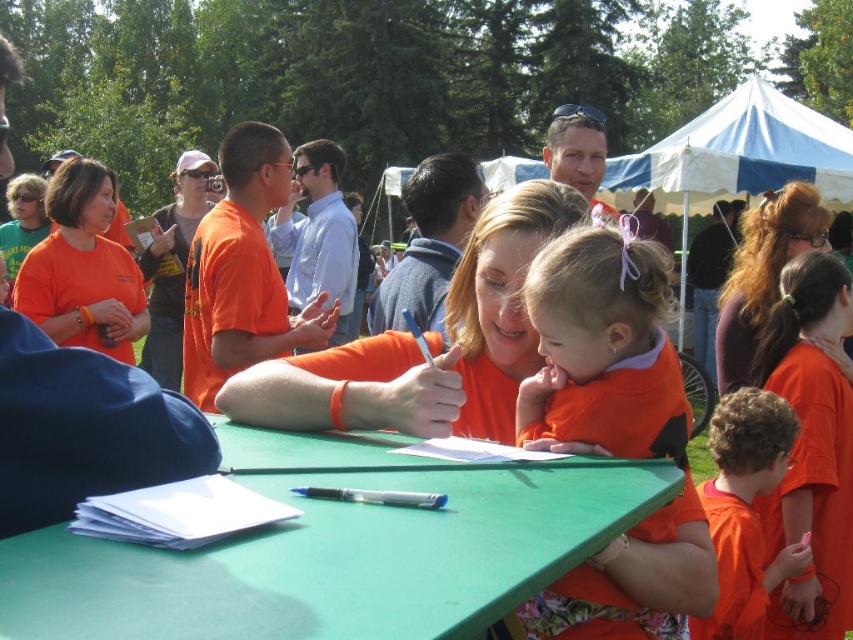
Who is positioned more to the left, green plastic table at center or orange matte shirt at lower right?

green plastic table at center

Which is more to the right, green plastic table at center or orange matte shirt at lower right?

From the viewer's perspective, orange matte shirt at lower right appears more on the right side.

Who is more distant from viewer, (146,582) or (741,582)?

The point (741,582) is more distant.

The image size is (853, 640). I want to click on green plastic table at center, so [x=337, y=548].

Is point (590, 307) more distant than point (697, 490)?

No, it is not.

The image size is (853, 640). In order to click on orange soft fabric baby at center in this screenshot , I will do `click(602, 346)`.

Does green plastic table at center have a lesser width compared to orange soft fabric baby at center?

No, green plastic table at center is not thinner than orange soft fabric baby at center.

Between point (346, 620) and point (683, 428), which one is positioned behind?

Positioned behind is point (683, 428).

Which is in front, point (612, 497) or point (564, 336)?

Point (612, 497) is in front.

This screenshot has height=640, width=853. Find the location of `green plastic table at center`. green plastic table at center is located at coordinates (337, 548).